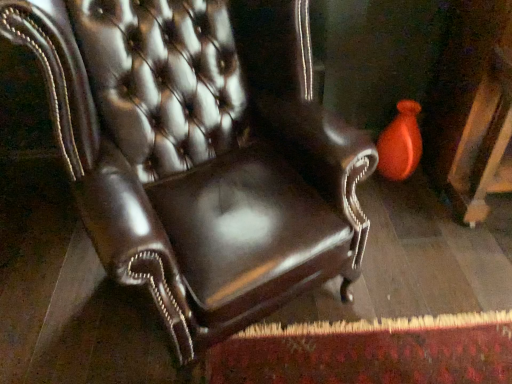
Question: From the image's perspective, is orange glossy vase at upper right above or below shiny leather chair at center?

Choices:
 (A) below
 (B) above

Answer: (B)

Question: From a real-world perspective, is orange glossy vase at upper right above or below shiny leather chair at center?

Choices:
 (A) above
 (B) below

Answer: (B)

Question: Is orange glossy vase at upper right wider or thinner than shiny leather chair at center?

Choices:
 (A) thin
 (B) wide

Answer: (A)

Question: In terms of size, does shiny leather chair at center appear bigger or smaller than orange glossy vase at upper right?

Choices:
 (A) big
 (B) small

Answer: (A)

Question: Is point 93,208 positioned closer to the camera than point 396,137?

Choices:
 (A) farther
 (B) closer

Answer: (B)

Question: Visually, is shiny leather chair at center positioned to the left or to the right of orange glossy vase at upper right?

Choices:
 (A) right
 (B) left

Answer: (B)

Question: From a real-world perspective, is shiny leather chair at center physically located above or below orange glossy vase at upper right?

Choices:
 (A) below
 (B) above

Answer: (B)